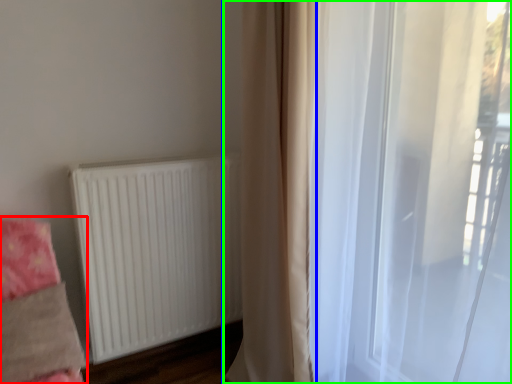
Question: Which is nearer to the bedding (highlighted by a red box)? curtain (highlighted by a blue box) or curtain (highlighted by a green box).

Choices:
 (A) curtain
 (B) curtain

Answer: (A)